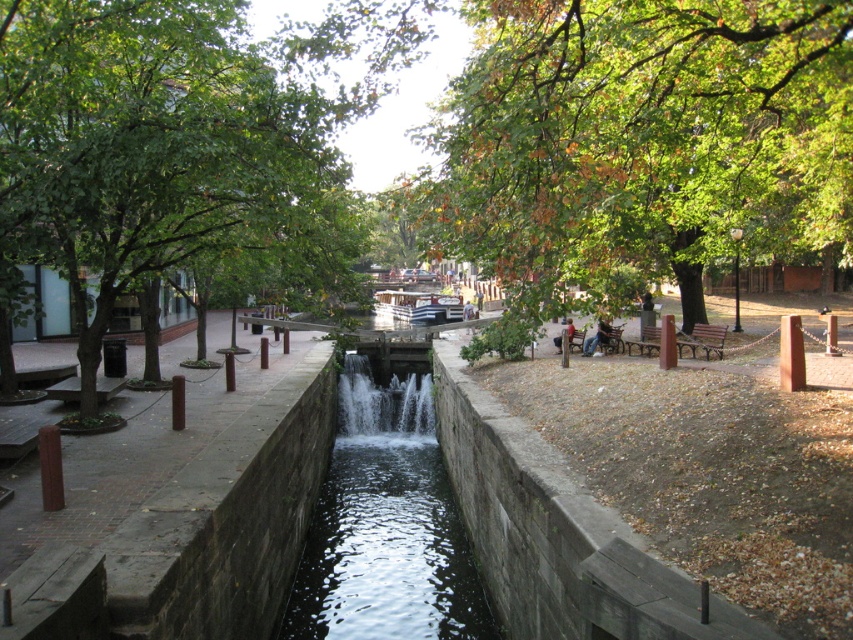
Question: Can you confirm if clear water at center is positioned below dark blue jeans at center?

Choices:
 (A) yes
 (B) no

Answer: (A)

Question: Which of the following is the closest to the observer?

Choices:
 (A) green leafy tree at upper center
 (B) clear water at center
 (C) leather jacket at center

Answer: (A)

Question: Which object appears closest to the camera in this image?

Choices:
 (A) green leafy tree at upper center
 (B) leather jacket at center
 (C) clear water at center

Answer: (A)

Question: Is green leafy tree at left smaller than leather jacket at center?

Choices:
 (A) yes
 (B) no

Answer: (B)

Question: Is green leafy tree at upper center smaller than clear water at center?

Choices:
 (A) no
 (B) yes

Answer: (A)

Question: Which object is positioned farthest from the clear water at center?

Choices:
 (A) green leafy tree at upper center
 (B) green leafy tree at left
 (C) leather jacket at center

Answer: (B)